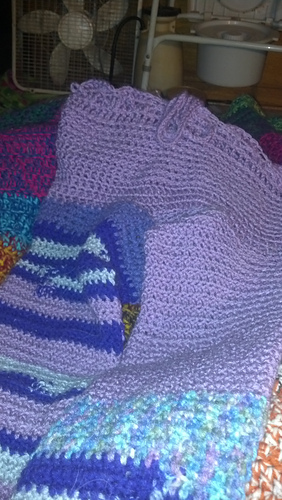
This screenshot has height=500, width=282. I want to click on pot, so point(230,71).